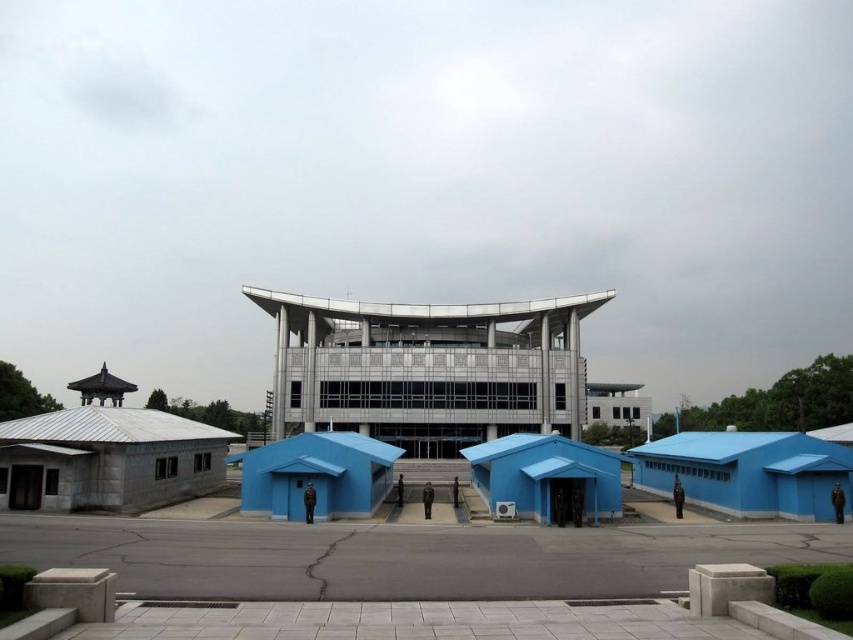
You are standing at the center of the image and want to find the blue matte shelter at lower right. According to the coordinates provided, in which direction should you look to locate it?

The blue matte shelter at lower right is located at coordinates point (747, 472), so you should look to your lower right direction to locate it.

You are standing in front of the main building and want to reach the blue matte shelter at lower right and the matte blue shelter at center. Which one is closer to you?

The blue matte shelter at lower right is closer to the viewer than the matte blue shelter at center, so it is closer to you.

You are a visitor approaching the main building and see the blue matte shelter at lower right and the blue matte shelter at center. Which one is positioned to the right side of the other?

The blue matte shelter at lower right is positioned to the right of the blue matte shelter at center.